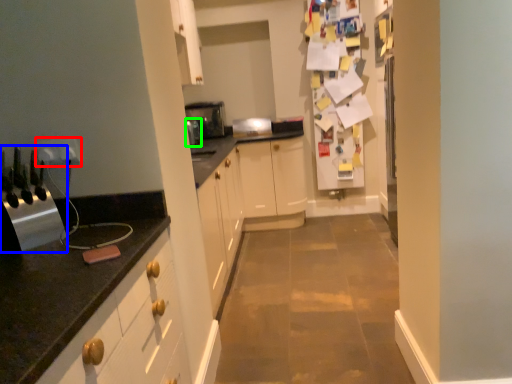
Question: Which is farther away from electric outlet (highlighted by a red box)? appliance (highlighted by a blue box) or appliance (highlighted by a green box)?

Choices:
 (A) appliance
 (B) appliance

Answer: (B)